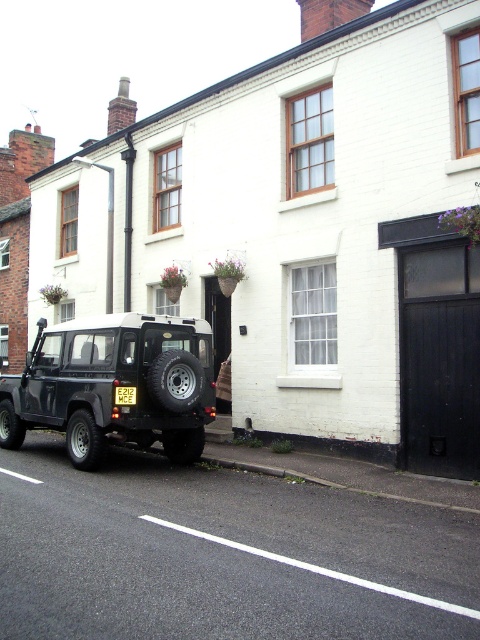
You are standing on the sidewalk in front of the white building. You see a point marked at coordinate (113,385). What object is located at that point?

The point at coordinate (113,385) marks the matte black jeep at lower left.

You are a photographer trying to capture both the matte black jeep at lower left and the yellow plastic license plate at center in a single frame. Given that your camera has a fixed focal length, which object should you position closer to the center of the frame to ensure both are clearly visible?

The matte black jeep at lower left should be positioned closer to the center of the frame since it is larger in width than the yellow plastic license plate at center, allowing both to fit within the frame more effectively.

You are a photographer trying to capture the matte black jeep at lower left and the yellow plastic license plate at center in a single shot. Since you want both objects to be clearly visible, which object should you focus on to ensure proper focus given their sizes?

The matte black jeep at lower left has a larger size compared to the yellow plastic license plate at center, so focusing on the larger matte black jeep at lower left will ensure both are in focus as it occupies more of the frame.